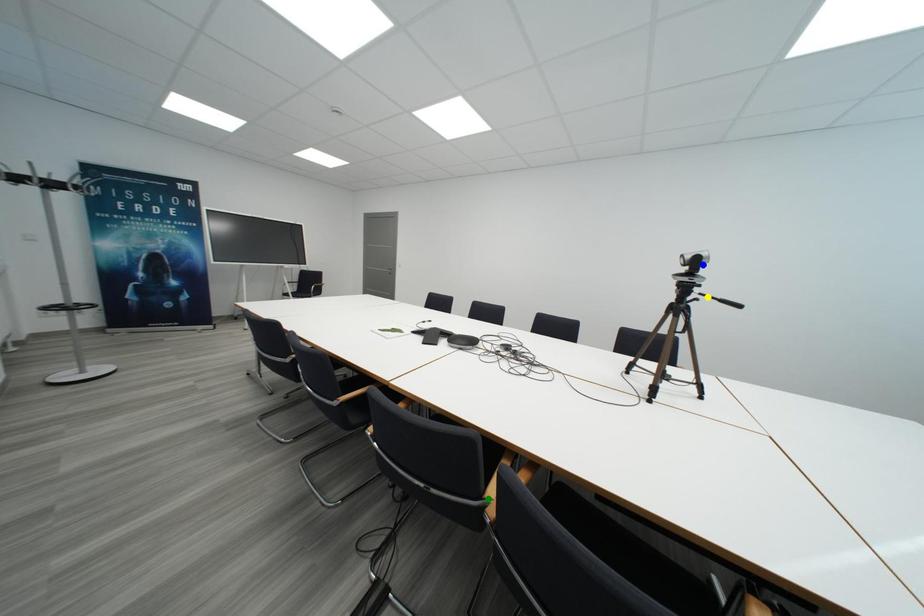
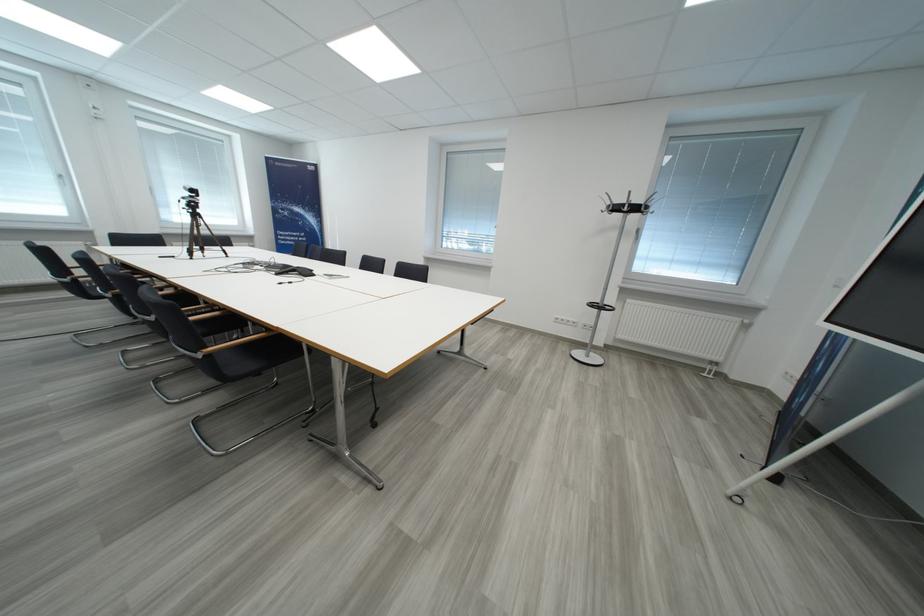
I am providing you with two images of the same scene from different viewpoints. Three points are marked in image1. Which point corresponds to a part or object that is occluded in image2?In image1, three points are marked. Which of them correspond to a part or object that is occluded in image2?Among the three points shown in image1, which one corresponds to a part or object that is no longer visible due to occlusion in image2?

Invisible in image2: yellow point, blue point, green point.